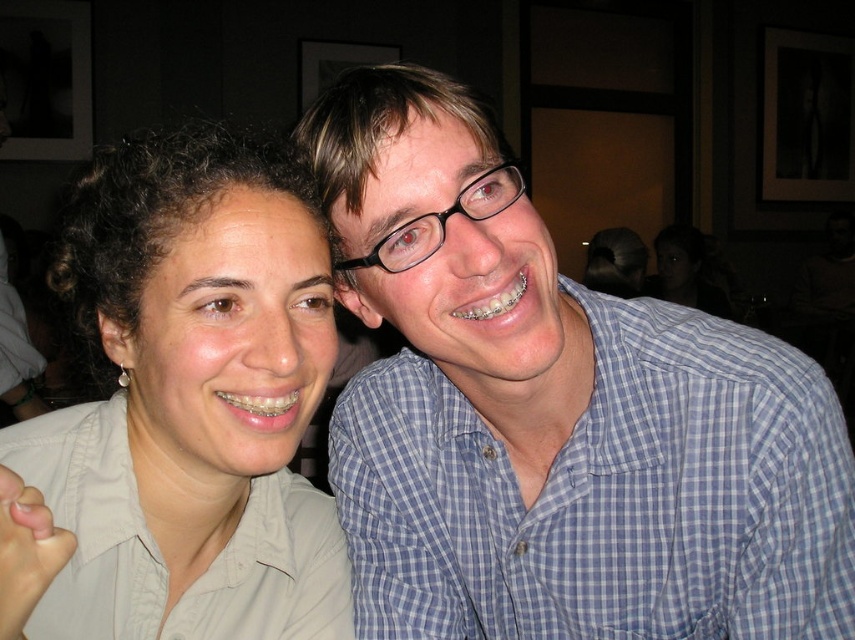
Who is lower down, matte khaki shirt at left or blue checkered shirt at right?

Positioned lower is blue checkered shirt at right.

Who is more distant from viewer, (202, 509) or (522, 499)?

The point (522, 499) is behind.

At what (x,y) coordinates should I click in order to perform the action: click on matte khaki shirt at left. Please return your answer as a coordinate pair (x, y). The width and height of the screenshot is (855, 640). Looking at the image, I should click on (181, 410).